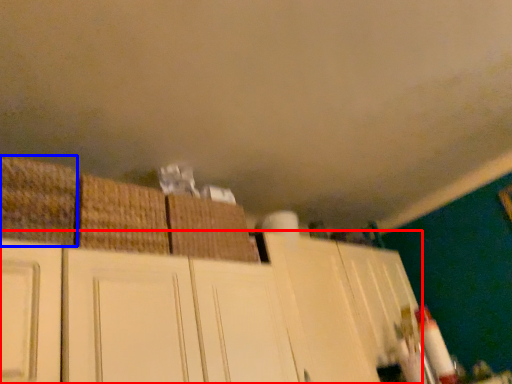
Question: Which of the following is the farthest to the observer, cabinetry (highlighted by a red box) or basket (highlighted by a blue box)?

Choices:
 (A) cabinetry
 (B) basket

Answer: (B)